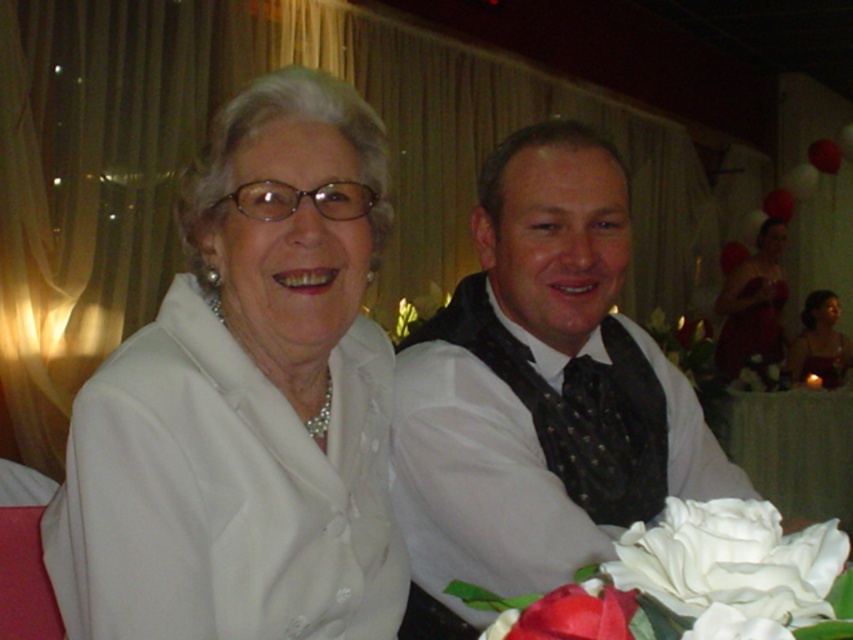
You are a photographer at a wedding reception. You need to place a small vase holding a matte red rose at lower center on a table. The white fabric table at lower right is the only table available. Can you place the rose there?

The white fabric table at lower right is positioned under the matte red rose at lower center, so the rose is already above the table. Therefore, you can place the vase on the white fabric table at lower right.

You are a photographer at a wedding reception. You want to capture a photo where both the white silk flowers at center and the matte red dress at right are clearly visible. Based on their positions, which object will appear larger in the photo?

The white silk flowers at center will appear larger in the photo because they are closer to the viewer than the matte red dress at right.